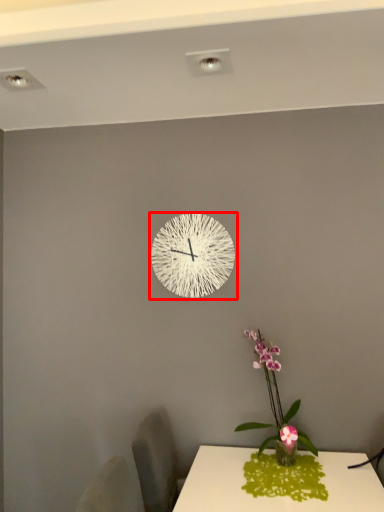
Question: Observing the image, what is the correct spatial positioning of wall clock (annotated by the red box) in reference to houseplant?

Choices:
 (A) right
 (B) left

Answer: (B)